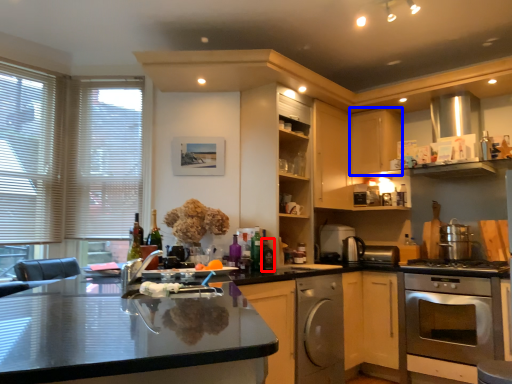
Question: Which point is closer to the camera, bottle (highlighted by a red box) or cabinetry (highlighted by a blue box)?

Choices:
 (A) bottle
 (B) cabinetry

Answer: (A)